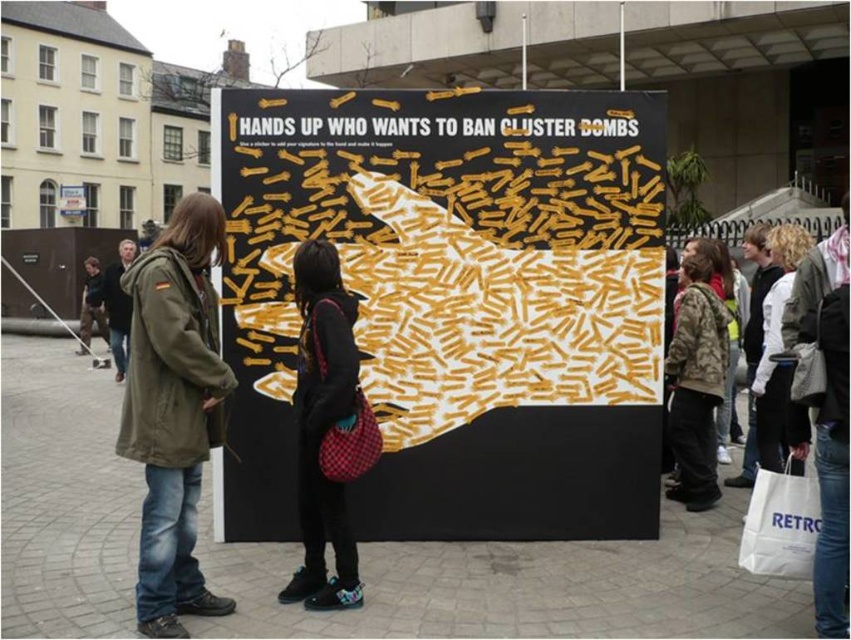
You are a photographer at the event and want to capture both the olive green parka at center and the dark brown leather jacket at center in a single shot. Based on their positions, which one should you focus on first to ensure both are in frame?

The olive green parka at center is located below the dark brown leather jacket at center, so you should focus on the dark brown leather jacket at center first to ensure both are in frame.

You are a photographer standing in front of the poster and you want to take a photo of the olive green parka at center and the dark brown leather jacket at center. Which one will be closer to the camera in the photo?

The olive green parka at center is in front of the dark brown leather jacket at center, so the olive green parka at center will be closer to the camera in the photo.

You are a photographer at the scene and want to capture both the black fabric jacket at center and the camouflage jacket at center in a single frame. Which jacket will appear smaller in the photo?

The black fabric jacket at center will appear smaller in the photo because it has a smaller size compared to the camouflage jacket at center.